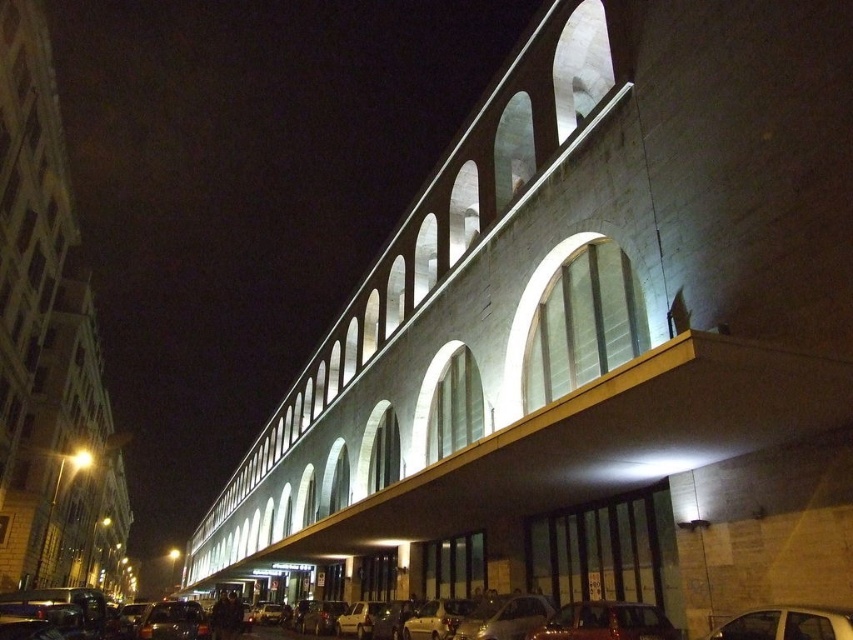
Find the location of `matte white sedan at lower center`. matte white sedan at lower center is located at coordinates (788, 625).

Does matte white sedan at lower center appear under shiny metallic car at lower center?

Yes, matte white sedan at lower center is below shiny metallic car at lower center.

What do you see at coordinates (788, 625) in the screenshot?
I see `matte white sedan at lower center` at bounding box center [788, 625].

Identify the location of matte white sedan at lower center. (788, 625).

Who is taller, white glossy car at lower right or shiny black car at lower left?

shiny black car at lower left

Is point (728, 621) positioned before point (192, 616)?

Yes, it is.

At what (x,y) coordinates should I click in order to perform the action: click on white glossy car at lower right. Please return your answer as a coordinate pair (x, y). Looking at the image, I should click on (787, 624).

Is point (618, 609) more distant than point (820, 611)?

That is True.

Based on the photo, who is more distant from viewer, [595,637] or [764,618]?

The point [595,637] is behind.

I want to click on shiny metallic car at lower center, so click(605, 621).